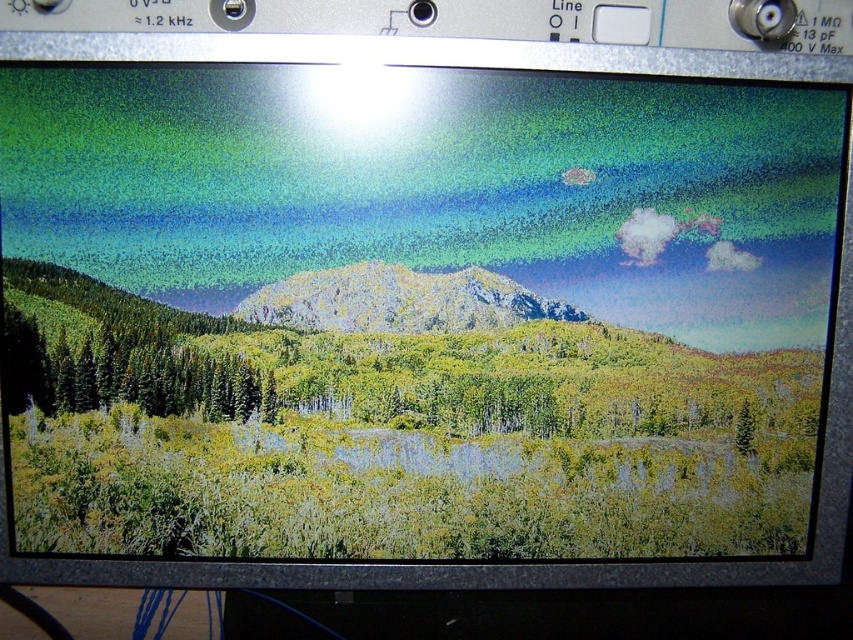
You are a hiker planning to take a photo of the rocky mountain at center from the green matte tree at left. Based on the scene, will the tree block your view of the mountain?

The green matte tree at left is to the left of the rocky mountain at center, so if you are positioned at the green matte tree at left, the mountain would be to your right, and the tree itself would not block your view of the rocky mountain at center.

You are a graphic designer working on a project and need to identify the color of the object located at point (126, 372) on the monitor. What is the color of the object at that coordinate?

The object at point (126, 372) is a green matte tree at left, so its color is green.

You are an engineer inspecting the monitor. You notice two points on the screen at coordinates point (410, 310) and point (740, 448). Based on the monitor display, which point is closer to your eyes?

Point (410, 310) is further to the viewer than point (740, 448). Therefore, point (740, 448) is closer to your eyes.